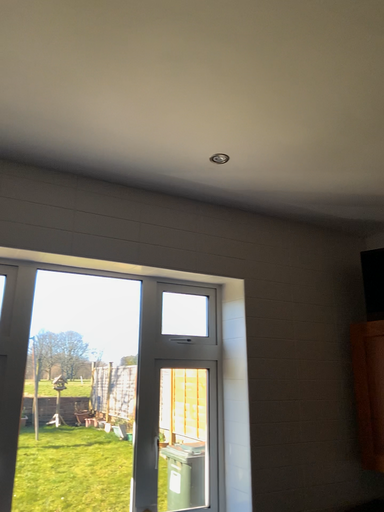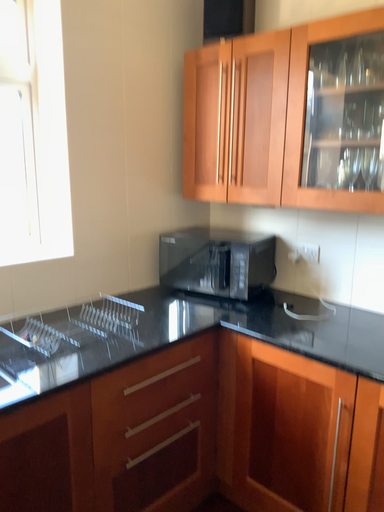
Question: How did the camera likely rotate when shooting the video?

Choices:
 (A) rotated downward
 (B) rotated upward

Answer: (A)